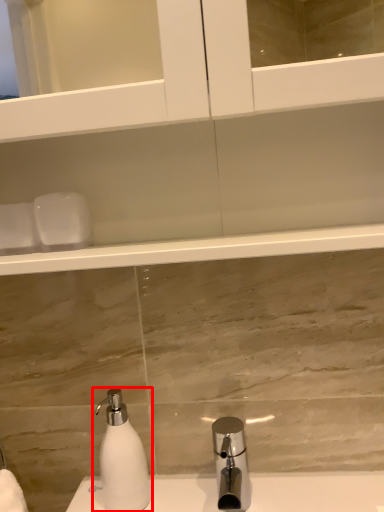
Question: In this image, where is soap dispenser (annotated by the red box) located relative to tap?

Choices:
 (A) right
 (B) left

Answer: (B)